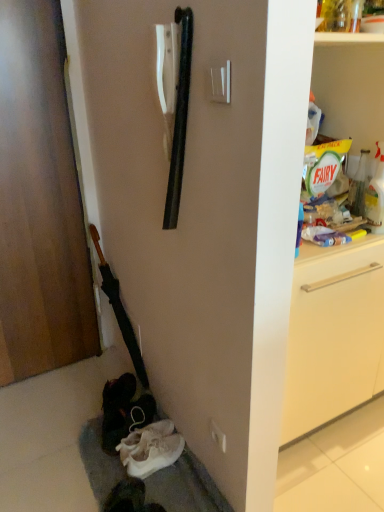
Question: Considering the relative sizes of white fabric shoes at lower left and white plastic electric outlet at center in the image provided, is white fabric shoes at lower left smaller than white plastic electric outlet at center?

Choices:
 (A) no
 (B) yes

Answer: (A)

Question: Is white fabric shoes at lower left looking in the opposite direction of white plastic electric outlet at center?

Choices:
 (A) no
 (B) yes

Answer: (A)

Question: Is the position of white fabric shoes at lower left more distant than that of white plastic electric outlet at center?

Choices:
 (A) yes
 (B) no

Answer: (B)

Question: Is white fabric shoes at lower left taller than white plastic electric outlet at center?

Choices:
 (A) yes
 (B) no

Answer: (B)

Question: Is white fabric shoes at lower left closer to camera compared to white plastic electric outlet at center?

Choices:
 (A) yes
 (B) no

Answer: (A)

Question: In the image, is white plastic electric outlet at center positioned in front of or behind white suede shoe at lower left?

Choices:
 (A) front
 (B) behind

Answer: (A)

Question: From the image's perspective, relative to white suede shoe at lower left, is white plastic electric outlet at center above or below?

Choices:
 (A) above
 (B) below

Answer: (A)

Question: Would you say white plastic electric outlet at center is to the left or to the right of white suede shoe at lower left in the picture?

Choices:
 (A) left
 (B) right

Answer: (B)

Question: Does point (218, 436) appear closer or farther from the camera than point (122, 446)?

Choices:
 (A) closer
 (B) farther

Answer: (A)

Question: Is wooden door at left taller or shorter than white fabric shoes at lower left?

Choices:
 (A) short
 (B) tall

Answer: (B)

Question: Is wooden door at left inside or outside of white fabric shoes at lower left?

Choices:
 (A) inside
 (B) outside

Answer: (B)

Question: From the image's perspective, relative to white fabric shoes at lower left, is wooden door at left above or below?

Choices:
 (A) above
 (B) below

Answer: (A)

Question: Based on their positions, is wooden door at left located to the left or right of white fabric shoes at lower left?

Choices:
 (A) left
 (B) right

Answer: (A)

Question: Considering the positions of point (94, 443) and point (210, 422), is point (94, 443) closer or farther from the camera than point (210, 422)?

Choices:
 (A) farther
 (B) closer

Answer: (A)

Question: From the image's perspective, is white fabric shoes at lower left positioned above or below white plastic electric outlet at center?

Choices:
 (A) below
 (B) above

Answer: (A)